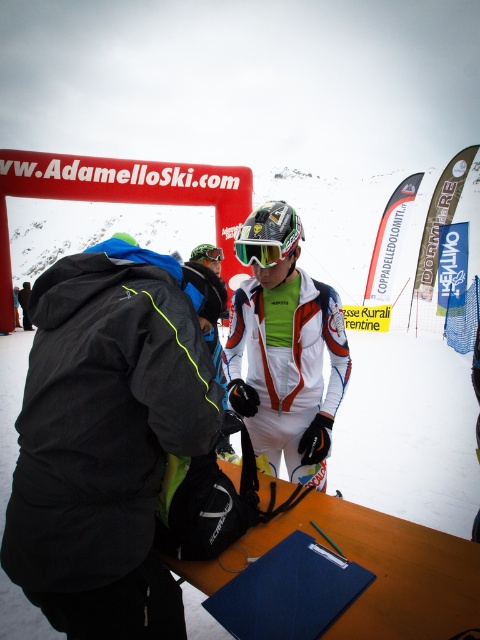
You are a photographer at the ski event and want to capture a photo of the white matte snowboarder at center without including the matte black jacket at center in the frame. Based on their positions, which direction should you move your camera to the right or left?

The matte black jacket at center is to the left of the white matte snowboarder at center, so moving the camera to the right would exclude the jacket and focus on the snowboarder.